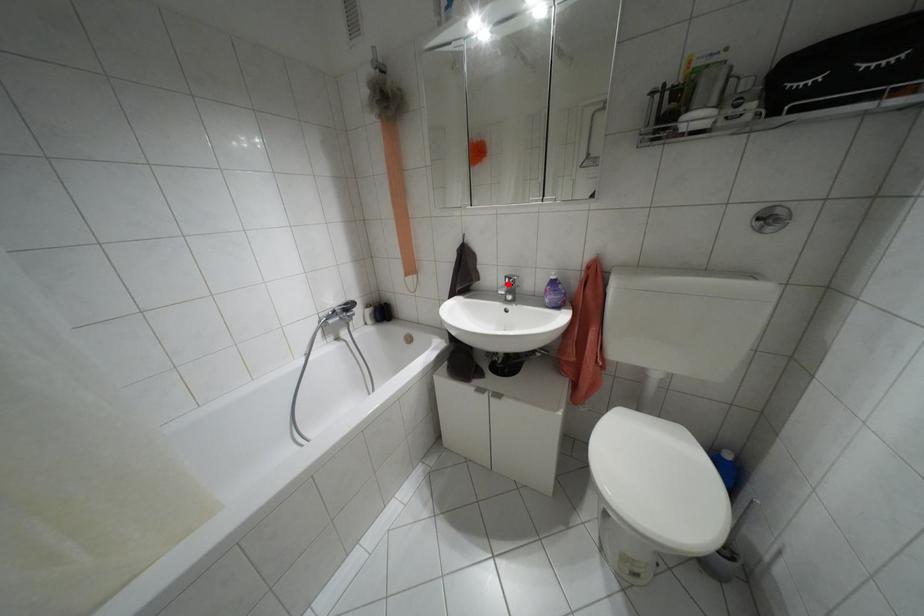
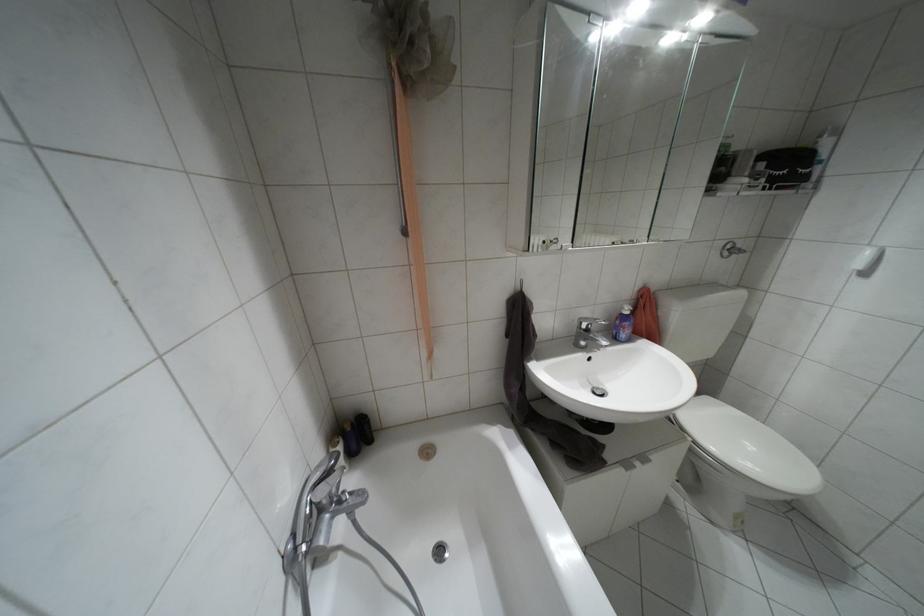
Locate, in the second image, the point that corresponds to the highlighted location in the first image.

(587, 330)